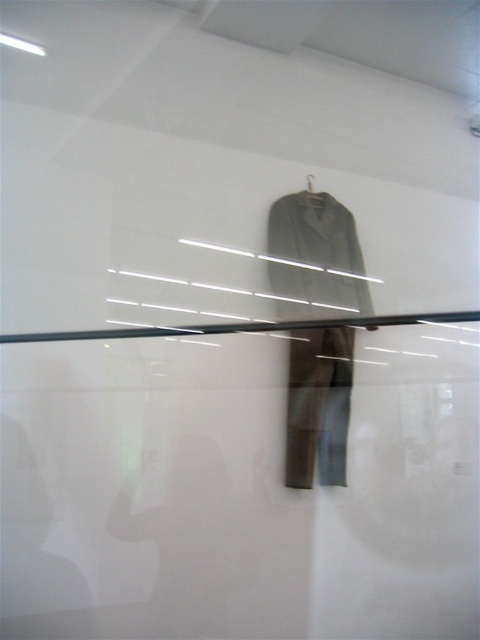
You are an interior designer planning to hang two garments in a minimalist space. You have a dark gray fabric suit at center and a gray fabric jacket at center. Which garment should you choose if you want the one that takes up more vertical space?

The dark gray fabric suit at center has a greater height compared to the gray fabric jacket at center, so it would take up more vertical space and is the better choice.